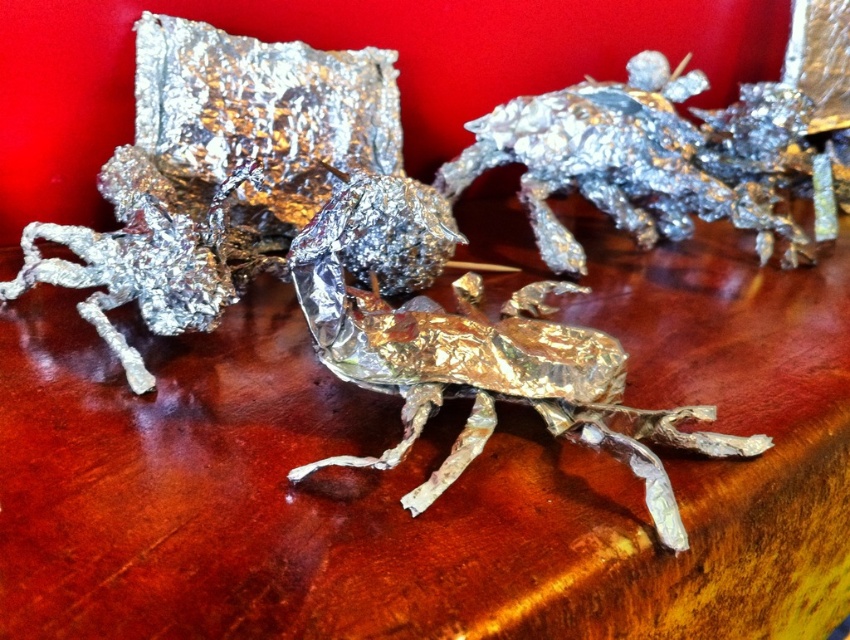
Question: From the image, what is the correct spatial relationship of gold foil insect at center in relation to shiny metallic crab at center?

Choices:
 (A) above
 (B) below

Answer: (B)

Question: Which point is farther to the camera?

Choices:
 (A) (517, 369)
 (B) (225, 205)
 (C) (765, 106)

Answer: (C)

Question: Among these points, which one is farthest from the camera?

Choices:
 (A) (653, 90)
 (B) (435, 396)
 (C) (128, 228)

Answer: (A)

Question: Can you confirm if shiny metallic crab at center is wider than shiny metallic insect at center-left?

Choices:
 (A) no
 (B) yes

Answer: (B)

Question: Which point is closer to the camera?

Choices:
 (A) (360, 371)
 (B) (621, 170)

Answer: (A)

Question: Can you confirm if shiny metallic crab at center is wider than shiny metallic insect at center-left?

Choices:
 (A) yes
 (B) no

Answer: (A)